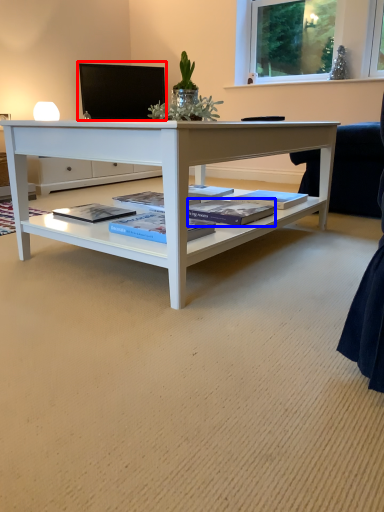
Question: Among these objects, which one is nearest to the camera, computer monitor (highlighted by a red box) or magazine (highlighted by a blue box)?

Choices:
 (A) computer monitor
 (B) magazine

Answer: (B)